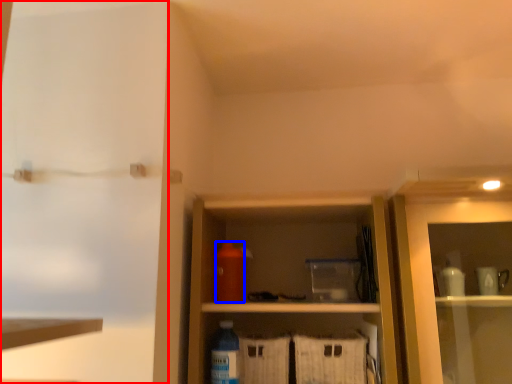
Question: Among these objects, which one is nearest to the camera, screen door (highlighted by a red box) or bottle (highlighted by a blue box)?

Choices:
 (A) screen door
 (B) bottle

Answer: (A)